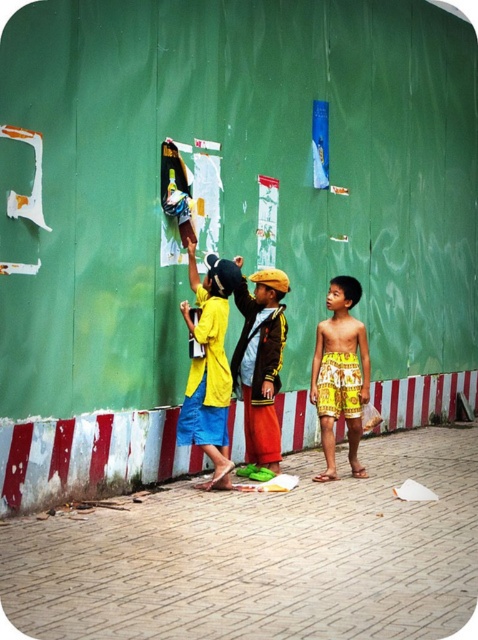
Question: Is yellow matte shirt at center thinner than yellow printed shorts at right?

Choices:
 (A) no
 (B) yes

Answer: (A)

Question: Which of the following is the farthest from the observer?

Choices:
 (A) (358, 371)
 (B) (232, 353)

Answer: (B)

Question: Is yellow matte shirt at center smaller than yellow printed shorts at right?

Choices:
 (A) yes
 (B) no

Answer: (A)

Question: Does yellow matte shirt at center appear on the right side of yellow fabric jacket at center?

Choices:
 (A) yes
 (B) no

Answer: (B)

Question: Which object is positioned farthest from the yellow printed shorts at right?

Choices:
 (A) yellow matte shirt at center
 (B) yellow fabric jacket at center

Answer: (A)

Question: Among these objects, which one is farthest from the camera?

Choices:
 (A) yellow printed shorts at right
 (B) yellow fabric jacket at center
 (C) yellow matte shirt at center

Answer: (A)